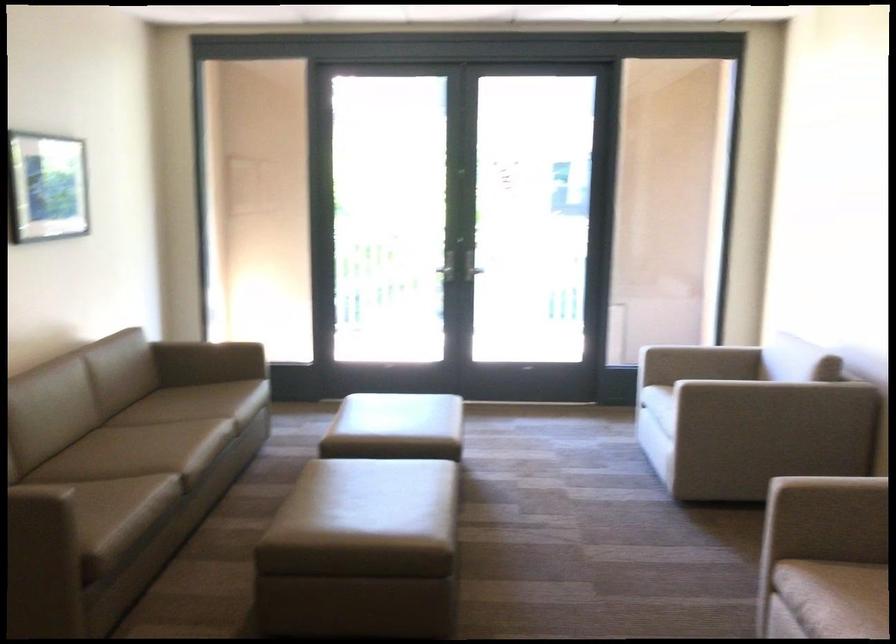
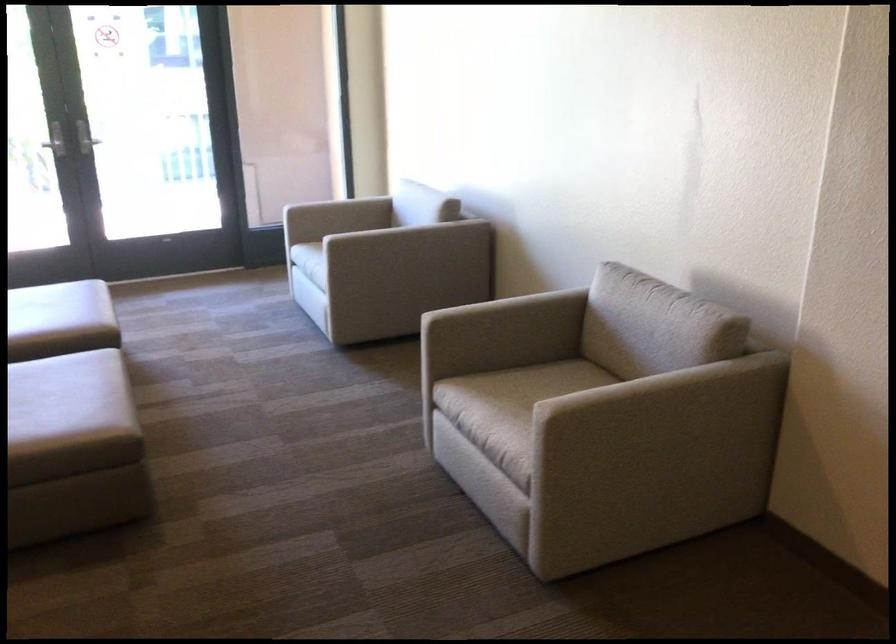
Locate, in the second image, the point that corresponds to (743,357) in the first image.

(375, 200)